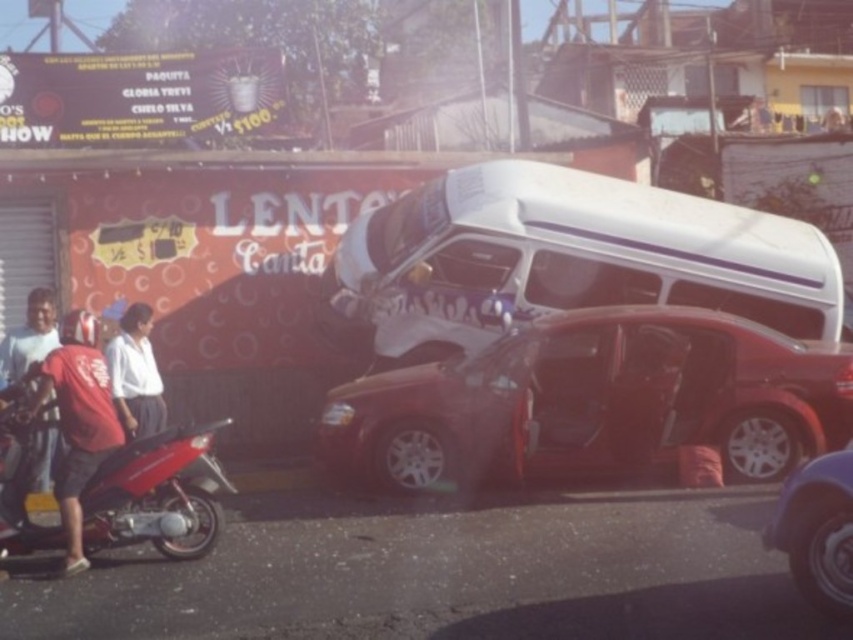
Which is below, shiny red sedan at center or shiny red motorcycle at left?

shiny red motorcycle at left is below.

Which is more to the left, shiny red sedan at center or shiny red motorcycle at left?

Positioned to the left is shiny red motorcycle at left.

Is point (363, 397) in front of point (91, 477)?

No, it is not.

In order to click on shiny red sedan at center in this screenshot , I will do `click(593, 403)`.

Does point (550, 189) come closer to viewer compared to point (9, 365)?

No.

From the picture: Who is more forward, (465, 285) or (24, 353)?

Positioned in front is point (24, 353).

Between point (587, 296) and point (45, 333), which one is positioned behind?

Point (587, 296)

Locate an element on the screen. This screenshot has width=853, height=640. white glossy van at center is located at coordinates (572, 257).

Does shiny red motorcycle at left lie in front of white matte shirt at center?

Yes, it is.

Can you confirm if shiny red motorcycle at left is positioned to the left of white matte shirt at center?

In fact, shiny red motorcycle at left is to the right of white matte shirt at center.

Locate an element on the screen. The height and width of the screenshot is (640, 853). shiny red motorcycle at left is located at coordinates (158, 493).